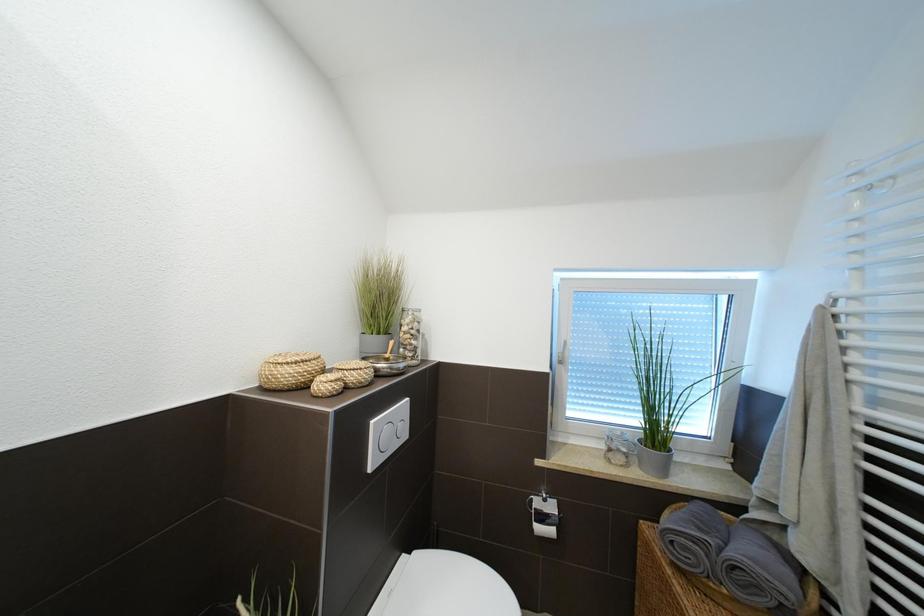
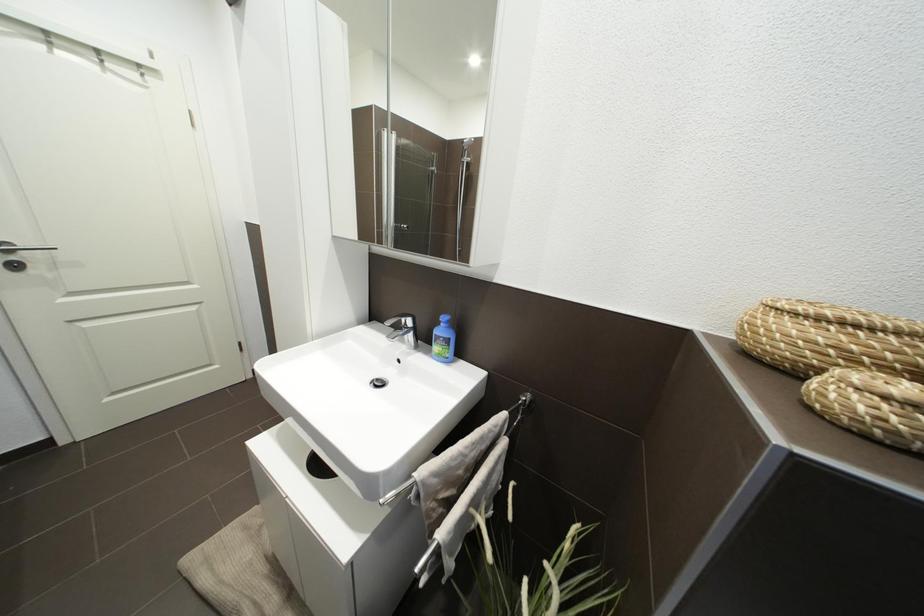
The images are taken continuously from a first-person perspective. In which direction is your viewpoint rotating?

The camera rotated toward left-down.